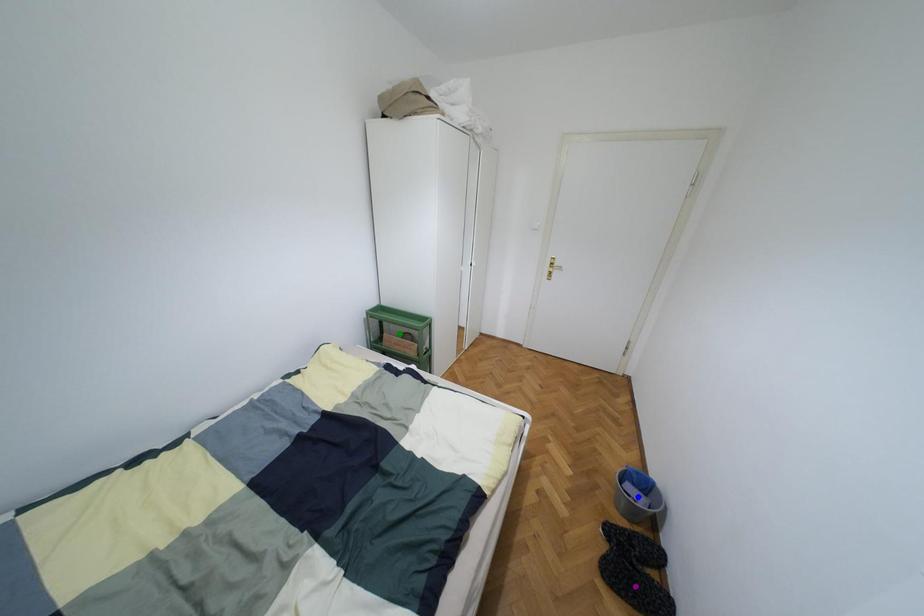
Order these from nearest to farthest:
green point | blue point | purple point

purple point
blue point
green point